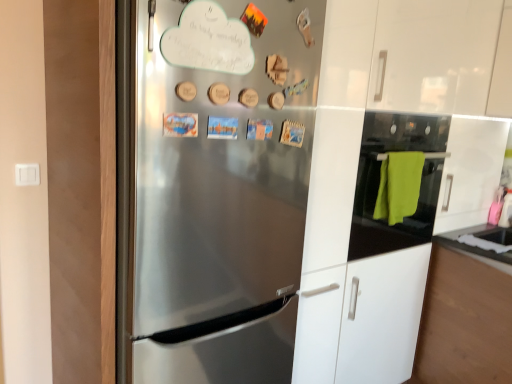
In order to face black glass oven at right, should I rotate leftwards or rightwards?

You should rotate right by 19.121 degrees.

The image size is (512, 384). What do you see at coordinates (380, 176) in the screenshot?
I see `black glass oven at right` at bounding box center [380, 176].

Where is `black glass oven at right`? This screenshot has height=384, width=512. black glass oven at right is located at coordinates (380, 176).

I want to click on stainless steel refrigerator at center, so click(220, 186).

Describe the element at coordinates (220, 186) in the screenshot. I see `stainless steel refrigerator at center` at that location.

I want to click on black glass oven at right, so click(380, 176).

Considering the positions of objects black glass oven at right and stainless steel refrigerator at center in the image provided, who is more to the left, black glass oven at right or stainless steel refrigerator at center?

Positioned to the left is stainless steel refrigerator at center.

Which is in front, black glass oven at right or stainless steel refrigerator at center?

stainless steel refrigerator at center.

Which point is more distant from viewer, (436, 165) or (225, 261)?

Positioned behind is point (436, 165).

From the image's perspective, who appears lower, black glass oven at right or stainless steel refrigerator at center?

stainless steel refrigerator at center is shown below in the image.

From a real-world perspective, between black glass oven at right and stainless steel refrigerator at center, who is vertically higher?

From a 3D spatial view, black glass oven at right is above.

Looking at their sizes, would you say black glass oven at right is wider or thinner than stainless steel refrigerator at center?

black glass oven at right is thinner than stainless steel refrigerator at center.

Is black glass oven at right taller or shorter than stainless steel refrigerator at center?

Considering their sizes, black glass oven at right has less height than stainless steel refrigerator at center.

Does black glass oven at right have a smaller size compared to stainless steel refrigerator at center?

Yes, black glass oven at right is smaller than stainless steel refrigerator at center.

Is black glass oven at right outside of stainless steel refrigerator at center?

Absolutely, black glass oven at right is external to stainless steel refrigerator at center.

Is black glass oven at right next to stainless steel refrigerator at center and touching it?

black glass oven at right and stainless steel refrigerator at center are not in contact.

Based on the photo, is black glass oven at right facing towards stainless steel refrigerator at center?

No, black glass oven at right is not oriented towards stainless steel refrigerator at center.

Can you tell me how much black glass oven at right and stainless steel refrigerator at center differ in facing direction?

0.000265 degrees separate the facing orientations of black glass oven at right and stainless steel refrigerator at center.

Locate an element on the screen. The height and width of the screenshot is (384, 512). refrigerator to the left of black glass oven at right is located at coordinates (220, 186).

Considering the positions of objects stainless steel refrigerator at center and black glass oven at right in the image provided, who is more to the right, stainless steel refrigerator at center or black glass oven at right?

Positioned to the right is black glass oven at right.

Is stainless steel refrigerator at center positioned before black glass oven at right?

Yes, stainless steel refrigerator at center is closer to the viewer.

Which is closer, (250, 255) or (378, 226)?

Point (250, 255).

From the image's perspective, is stainless steel refrigerator at center beneath black glass oven at right?

Yes, from the image's perspective, stainless steel refrigerator at center is below black glass oven at right.

From a real-world perspective, is stainless steel refrigerator at center on black glass oven at right?

No, from a real-world perspective, stainless steel refrigerator at center is not on top of black glass oven at right.

In terms of width, does stainless steel refrigerator at center look wider or thinner when compared to black glass oven at right?

stainless steel refrigerator at center is wider than black glass oven at right.

Which of these two, stainless steel refrigerator at center or black glass oven at right, stands taller?

With more height is stainless steel refrigerator at center.

Based on their sizes in the image, would you say stainless steel refrigerator at center is bigger or smaller than black glass oven at right?

In the image, stainless steel refrigerator at center appears to be larger than black glass oven at right.

Is stainless steel refrigerator at center outside of black glass oven at right?

Yes, stainless steel refrigerator at center is located beyond the bounds of black glass oven at right.

In the scene shown: Are stainless steel refrigerator at center and black glass oven at right beside each other?

No, stainless steel refrigerator at center is not in contact with black glass oven at right.

Is stainless steel refrigerator at center oriented away from black glass oven at right?

stainless steel refrigerator at center is not turned away from black glass oven at right.

What's the angular difference between stainless steel refrigerator at center and black glass oven at right's facing directions?

stainless steel refrigerator at center and black glass oven at right are facing 0.000265 degrees away from each other.

How distant is stainless steel refrigerator at center from black glass oven at right?

They are 26.16 inches apart.

Identify the location of oven positioned vertically above the stainless steel refrigerator at center (from a real-world perspective). The width and height of the screenshot is (512, 384). (380, 176).

I want to click on oven that appears on the right of stainless steel refrigerator at center, so [380, 176].

Identify the location of refrigerator in front of the black glass oven at right. This screenshot has height=384, width=512. (220, 186).